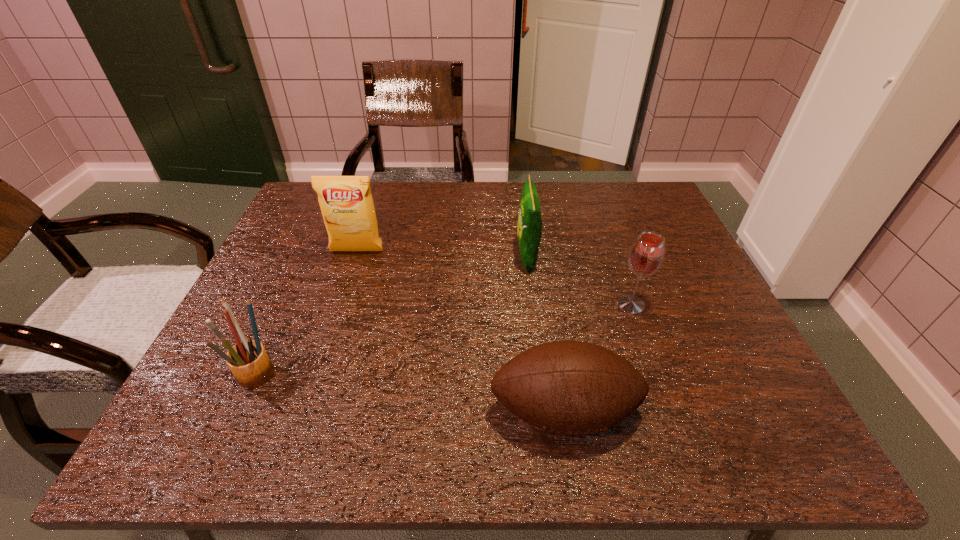
Locate which object ranks third in proximity to the wineglass. Please provide its 2D coordinates. Your answer should be formatted as a tuple, i.e. [(x, y)], where the tuple contains the x and y coordinates of a point satisfying the conditions above.

[(346, 202)]

The height and width of the screenshot is (540, 960). Find the location of `the fourth closest object to the right crisp (potato chip)`. the fourth closest object to the right crisp (potato chip) is located at coordinates (248, 361).

You are a GUI agent. You are given a task and a screenshot of the screen. Output one action in this format:
    pyautogui.click(x=<x>, y=<y>)
    Task: Click on the blank area in the image that satisfies the following two spatial constraints: 1. on the front of the left crisp (potato chip) with the logo; 2. on the left side of the third nearest object
    Image resolution: width=960 pixels, height=540 pixels.
    Given the screenshot: What is the action you would take?
    pyautogui.click(x=340, y=305)

Find the location of a particular element. The height and width of the screenshot is (540, 960). blank space that satisfies the following two spatial constraints: 1. on the front of the left crisp (potato chip) with the logo; 2. on the right side of the rightmost object is located at coordinates (340, 305).

Find the location of a particular element. This screenshot has width=960, height=540. vacant space that satisfies the following two spatial constraints: 1. on the front-facing side of the right crisp (potato chip); 2. on the left side of the third farthest object is located at coordinates (533, 305).